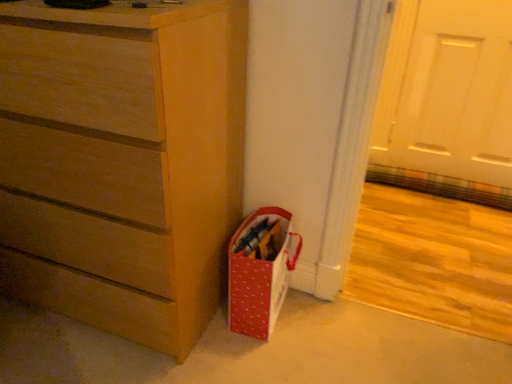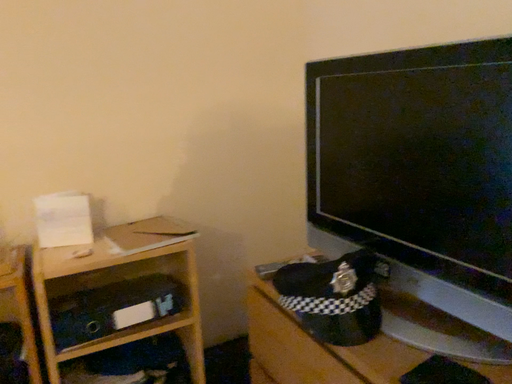
Question: Which way did the camera rotate in the video?

Choices:
 (A) rotated upward
 (B) rotated downward

Answer: (A)